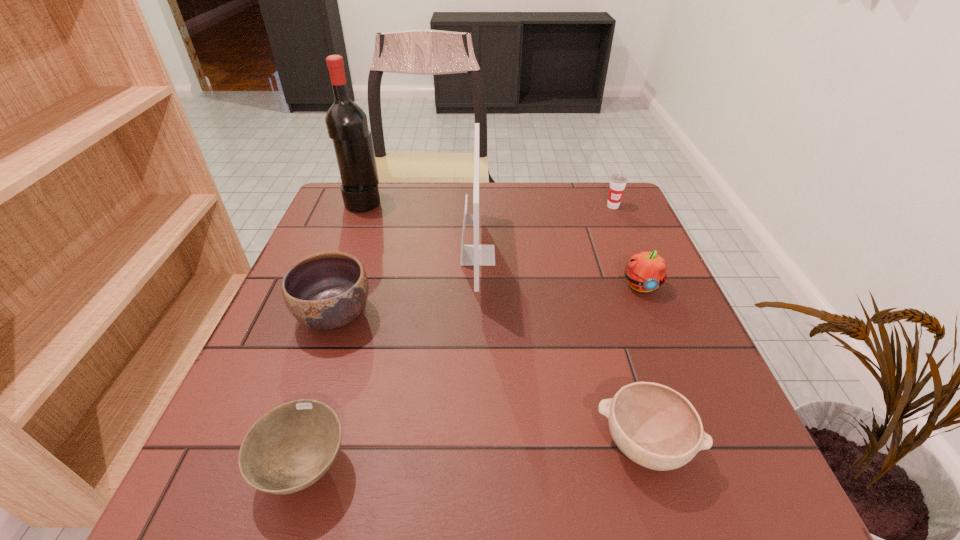
Find the location of a particular element. The width and height of the screenshot is (960, 540). wine bottle is located at coordinates (346, 122).

Where is `the second tallest object`? The height and width of the screenshot is (540, 960). the second tallest object is located at coordinates (476, 255).

I want to click on the fourth object from right to left, so click(x=476, y=255).

What are the coordinates of `cup` in the screenshot? It's located at point(618,182).

Identify the location of the farthest bowl. (328, 290).

Where is `apple`? apple is located at coordinates (645, 271).

The image size is (960, 540). What are the coordinates of `the rightmost bowl` in the screenshot? It's located at (655, 426).

Locate an element on the screen. The image size is (960, 540). free location located 0.300m on the front of the wine bottle is located at coordinates (332, 286).

Locate an element on the screen. Image resolution: width=960 pixels, height=540 pixels. blank area located 0.070m on the front-facing side of the second tallest object is located at coordinates (523, 255).

The height and width of the screenshot is (540, 960). I want to click on blank space located on the side of the cup with the logo, so click(x=646, y=285).